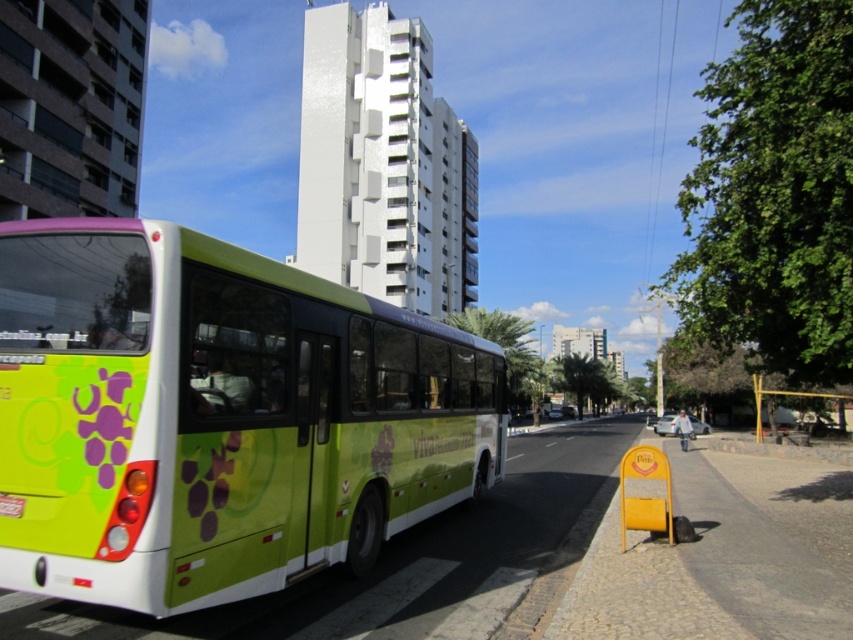
Question: Does green matte bus at left appear over metallic yellow bus stop at lower right?

Choices:
 (A) yes
 (B) no

Answer: (A)

Question: Among these objects, which one is farthest from the camera?

Choices:
 (A) metallic yellow bus stop at lower right
 (B) green matte bus at left

Answer: (A)

Question: Among these objects, which one is nearest to the camera?

Choices:
 (A) green matte bus at left
 (B) metallic yellow bus stop at lower right

Answer: (A)

Question: Which point is closer to the camera?

Choices:
 (A) metallic yellow bus stop at lower right
 (B) green matte bus at left

Answer: (B)

Question: Can you confirm if green matte bus at left is bigger than metallic yellow bus stop at lower right?

Choices:
 (A) yes
 (B) no

Answer: (B)

Question: Can you confirm if green matte bus at left is positioned to the right of metallic yellow bus stop at lower right?

Choices:
 (A) yes
 (B) no

Answer: (B)